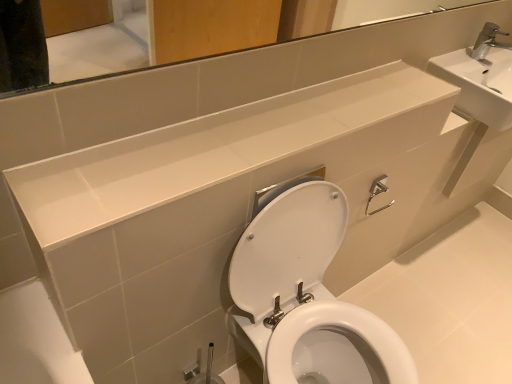
The width and height of the screenshot is (512, 384). What do you see at coordinates (208, 150) in the screenshot? I see `white glossy counter top at upper center` at bounding box center [208, 150].

Describe the element at coordinates (481, 78) in the screenshot. I see `white ceramic sink at upper right` at that location.

Measure the distance between white ceramic sink at upper right and camera.

4.49 feet.

Describe the element at coordinates (123, 73) in the screenshot. I see `white glossy mirror at upper center` at that location.

In order to click on white glossy mirror at upper center in this screenshot , I will do click(x=123, y=73).

Find the location of a particular element. The height and width of the screenshot is (384, 512). white glossy toilet at center is located at coordinates (306, 298).

Where is `white glossy counter top at upper center`? The height and width of the screenshot is (384, 512). white glossy counter top at upper center is located at coordinates (208, 150).

From a real-world perspective, is white ceramic sink at upper right physically located above or below white glossy toilet at center?

From a real-world perspective, white ceramic sink at upper right is physically above white glossy toilet at center.

Does white ceramic sink at upper right have a greater width compared to white glossy toilet at center?

No.

Does white ceramic sink at upper right appear on the right side of white glossy toilet at center?

Correct, you'll find white ceramic sink at upper right to the right of white glossy toilet at center.

From a real-world perspective, is white ceramic sink at upper right beneath white glossy mirror at upper center?

Correct, in the physical world, white ceramic sink at upper right is lower than white glossy mirror at upper center.

Based on the photo, considering the sizes of objects white ceramic sink at upper right and white glossy mirror at upper center in the image provided, who is bigger, white ceramic sink at upper right or white glossy mirror at upper center?

white ceramic sink at upper right is bigger.

Considering the relative sizes of white ceramic sink at upper right and white glossy mirror at upper center in the image provided, is white ceramic sink at upper right shorter than white glossy mirror at upper center?

No, white ceramic sink at upper right is not shorter than white glossy mirror at upper center.

Between white ceramic sink at upper right and white glossy mirror at upper center, which one has larger width?

With larger width is white ceramic sink at upper right.

Is white glossy mirror at upper center in contact with white glossy counter top at upper center?

white glossy mirror at upper center and white glossy counter top at upper center are clearly separated.

Visually, is white glossy mirror at upper center positioned to the left or to the right of white glossy counter top at upper center?

white glossy mirror at upper center is to the right of white glossy counter top at upper center.

Is white glossy counter top at upper center bigger than white ceramic sink at upper right?

Incorrect, white glossy counter top at upper center is not larger than white ceramic sink at upper right.

What's the angular difference between white glossy counter top at upper center and white ceramic sink at upper right's facing directions?

There is a 0.349-degree angle between the facing directions of white glossy counter top at upper center and white ceramic sink at upper right.

Which is behind, point (239, 165) or point (496, 69)?

Point (496, 69)

From the image's perspective, relative to white ceramic sink at upper right, is white glossy counter top at upper center above or below?

From the image's perspective, white glossy counter top at upper center appears below white ceramic sink at upper right.

Is there a large distance between white glossy counter top at upper center and white glossy mirror at upper center?

Actually, white glossy counter top at upper center and white glossy mirror at upper center are a little close together.

Based on the photo, considering the sizes of objects white glossy counter top at upper center and white glossy mirror at upper center in the image provided, who is taller, white glossy counter top at upper center or white glossy mirror at upper center?

Standing taller between the two is white glossy mirror at upper center.

Is point (178, 159) closer or farther from the camera than point (94, 78)?

Point (178, 159).

From a real-world perspective, is white glossy toilet at center located higher than white glossy counter top at upper center?

No, from a real-world perspective, white glossy toilet at center is not over white glossy counter top at upper center

Who is bigger, white glossy toilet at center or white glossy counter top at upper center?

white glossy toilet at center.

Which of these two, white glossy toilet at center or white glossy counter top at upper center, is wider?

white glossy toilet at center is wider.

Can you confirm if white glossy toilet at center is positioned to the right of white glossy counter top at upper center?

Yes.

Which is in front, point (102, 78) or point (478, 79)?

Positioned in front is point (102, 78).

From a real-world perspective, which object stands above the other?

white glossy mirror at upper center, from a real-world perspective.

Which of these two, white glossy mirror at upper center or white ceramic sink at upper right, stands taller?

Standing taller between the two is white ceramic sink at upper right.

Is white glossy mirror at upper center closer to camera compared to white ceramic sink at upper right?

Yes, white glossy mirror at upper center is in front of white ceramic sink at upper right.

I want to click on sink that is on the right side of white glossy toilet at center, so click(x=481, y=78).

You are a GUI agent. You are given a task and a screenshot of the screen. Output one action in this format:
    pyautogui.click(x=<x>, y=<y>)
    Task: Click on the mirror in front of the white ceramic sink at upper right
    The image size is (512, 384).
    Given the screenshot: What is the action you would take?
    pyautogui.click(x=123, y=73)

Which object lies nearer to the anchor point white glossy toilet at center, white glossy counter top at upper center or white glossy mirror at upper center?

white glossy counter top at upper center.

Based on their spatial positions, is white glossy mirror at upper center or white glossy toilet at center further from white glossy counter top at upper center?

white glossy toilet at center is further to white glossy counter top at upper center.

When comparing their distances from white glossy toilet at center, does white ceramic sink at upper right or white glossy mirror at upper center seem further?

white ceramic sink at upper right is positioned further to the anchor white glossy toilet at center.

Consider the image. When comparing their distances from white ceramic sink at upper right, does white glossy mirror at upper center or white glossy counter top at upper center seem further?

Based on the image, white glossy counter top at upper center appears to be further to white ceramic sink at upper right.

Which object lies further to the anchor point white glossy mirror at upper center, white glossy toilet at center or white glossy counter top at upper center?

white glossy toilet at center is positioned further to the anchor white glossy mirror at upper center.

Estimate the real-world distances between objects in this image. Which object is closer to white ceramic sink at upper right, white glossy counter top at upper center or white glossy mirror at upper center?

Based on the image, white glossy mirror at upper center appears to be nearer to white ceramic sink at upper right.

Looking at the image, which one is located closer to white glossy toilet at center, white ceramic sink at upper right or white glossy counter top at upper center?

The object closer to white glossy toilet at center is white glossy counter top at upper center.

From the image, which object appears to be nearer to white glossy counter top at upper center, white glossy mirror at upper center or white ceramic sink at upper right?

The object closer to white glossy counter top at upper center is white glossy mirror at upper center.

Locate an element on the screen. counter top between white glossy mirror at upper center and white glossy toilet at center from top to bottom is located at coordinates (208, 150).

The image size is (512, 384). Identify the location of mirror between white glossy counter top at upper center and white ceramic sink at upper right in the horizontal direction. (123, 73).

Locate an element on the screen. sink between white glossy mirror at upper center and white glossy toilet at center from top to bottom is located at coordinates (481, 78).

Where is `counter top between white ceramic sink at upper right and white glossy toilet at center from top to bottom`? This screenshot has width=512, height=384. counter top between white ceramic sink at upper right and white glossy toilet at center from top to bottom is located at coordinates (208, 150).